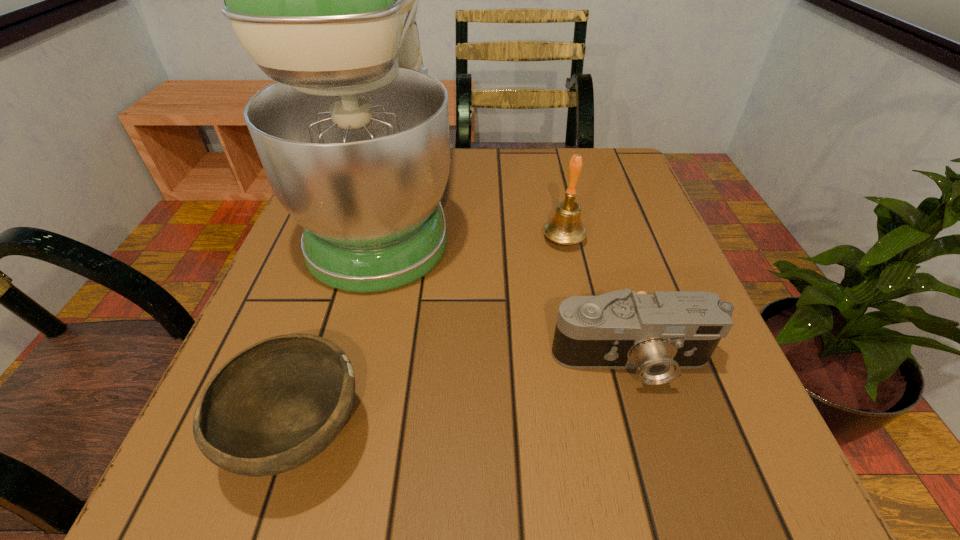
This screenshot has height=540, width=960. Identify the location of mixer. tap(353, 136).

Where is `bell`? The height and width of the screenshot is (540, 960). bell is located at coordinates (565, 227).

Identify the location of camera. Image resolution: width=960 pixels, height=540 pixels. (659, 334).

Identify the location of bowl. This screenshot has height=540, width=960. (276, 405).

The width and height of the screenshot is (960, 540). Find the location of `blank area located on the controls of the tallest object`. blank area located on the controls of the tallest object is located at coordinates (570, 213).

Image resolution: width=960 pixels, height=540 pixels. I want to click on vacant space situated 0.390m on the left of the bell, so click(346, 239).

Find the location of `vacant space located 0.050m on the lens of the camera`. vacant space located 0.050m on the lens of the camera is located at coordinates (650, 424).

The width and height of the screenshot is (960, 540). Find the location of `vacant space situated 0.210m on the back of the bowl`. vacant space situated 0.210m on the back of the bowl is located at coordinates (348, 276).

You are a GUI agent. You are given a task and a screenshot of the screen. Output one action in this format:
    pyautogui.click(x=<x>, y=<y>)
    Task: Click on the object that is at the far edge
    The image size is (960, 540).
    Given the screenshot: What is the action you would take?
    pyautogui.click(x=353, y=136)

Identify the location of object located at the near edge. (276, 405).